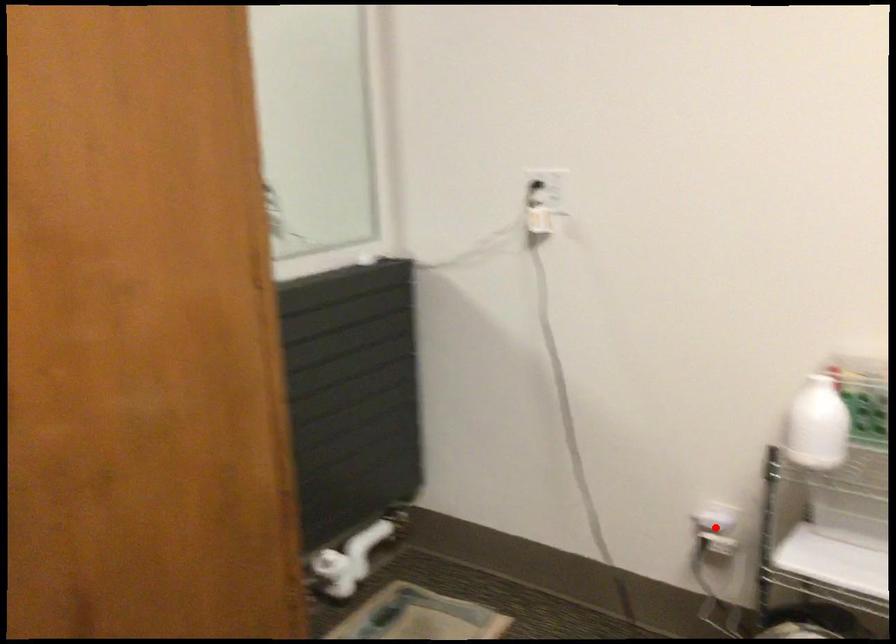
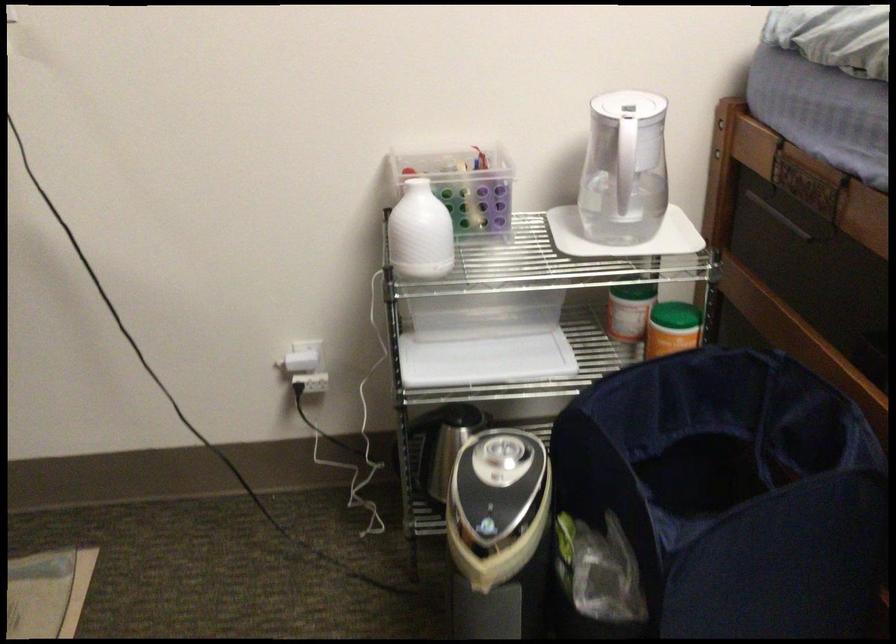
Where in the second image is the point corresponding to the highlighted location from the first image?

(306, 366)